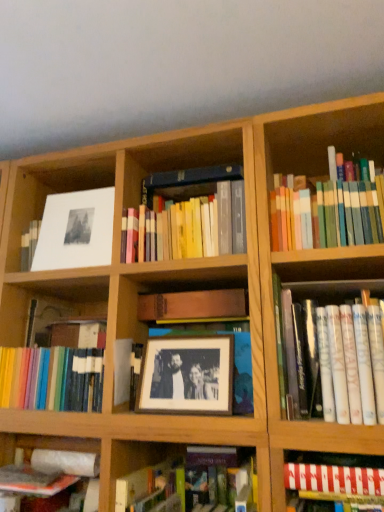
Question: Is hardcover books at center, the second book viewed from the top, taller or shorter than white paperback book at right, the third book positioned from the top?

Choices:
 (A) short
 (B) tall

Answer: (A)

Question: In terms of width, does hardcover books at center, the sixth book positioned from the bottom, look wider or thinner when compared to white paperback book at right, the fifth book positioned from the bottom?

Choices:
 (A) thin
 (B) wide

Answer: (A)

Question: Which object is the closest to the hardcover book at center, the 4th book from the bottom?

Choices:
 (A) white paperback book at right, the third book positioned from the top
 (B) hardcover books at upper right, which appears as the seventh book when ordered from the bottom
 (C) hardcover book at lower center, placed as the sixth book when sorted from top to bottom
 (D) striped paper book at lower right, the fifth book positioned from the top
 (E) hardcover books at center, the sixth book positioned from the bottom

Answer: (C)

Question: Considering the real-world distances, which object is closest to the hardcover book at center, the 4th book from the bottom?

Choices:
 (A) hardcover book at lower center, the second book in the bottom-to-top sequence
 (B) wooden frame at center
 (C) striped paper book at lower right, the fifth book positioned from the top
 (D) white paperback book at right, the third book positioned from the top
 (E) hardcover books at upper right, the 1th book in the top-to-bottom sequence

Answer: (B)